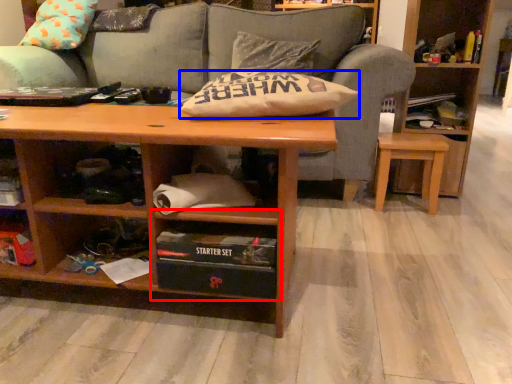
Question: Which point is closer to the camera, cabinet (highlighted by a red box) or pillow (highlighted by a blue box)?

Choices:
 (A) cabinet
 (B) pillow

Answer: (A)